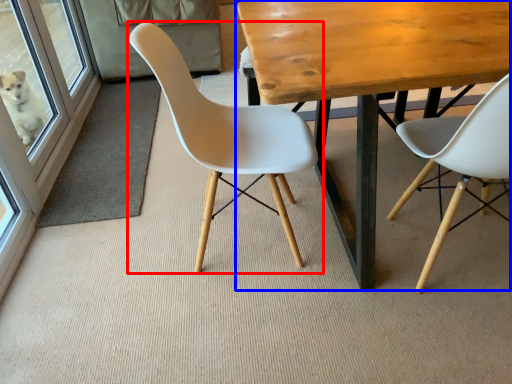
Question: Which object is further to the camera taking this photo, chair (highlighted by a red box) or table (highlighted by a blue box)?

Choices:
 (A) chair
 (B) table

Answer: (A)